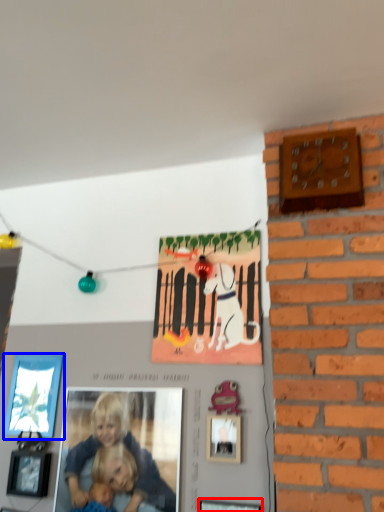
Question: Which point is further to the camera, picture frame (highlighted by a red box) or picture frame (highlighted by a blue box)?

Choices:
 (A) picture frame
 (B) picture frame

Answer: (B)